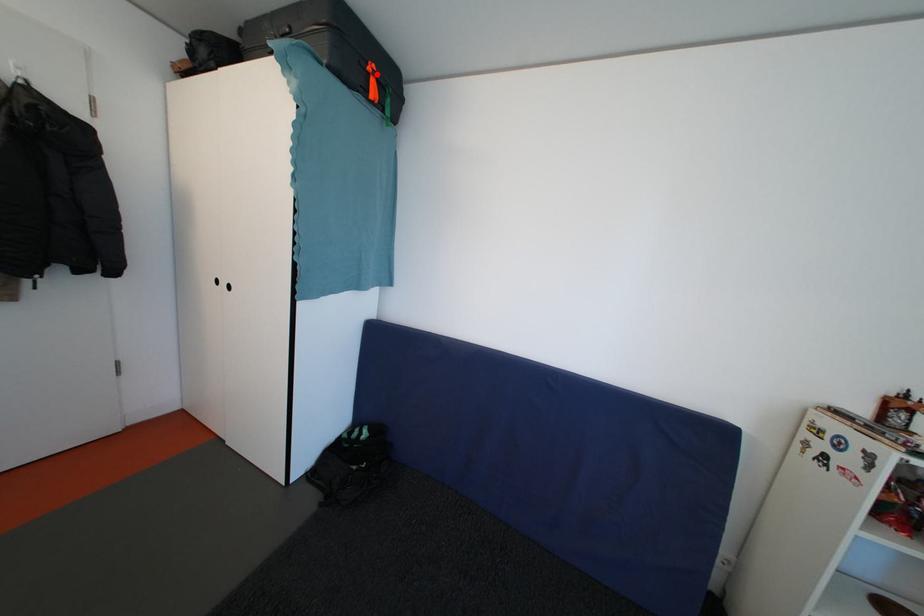
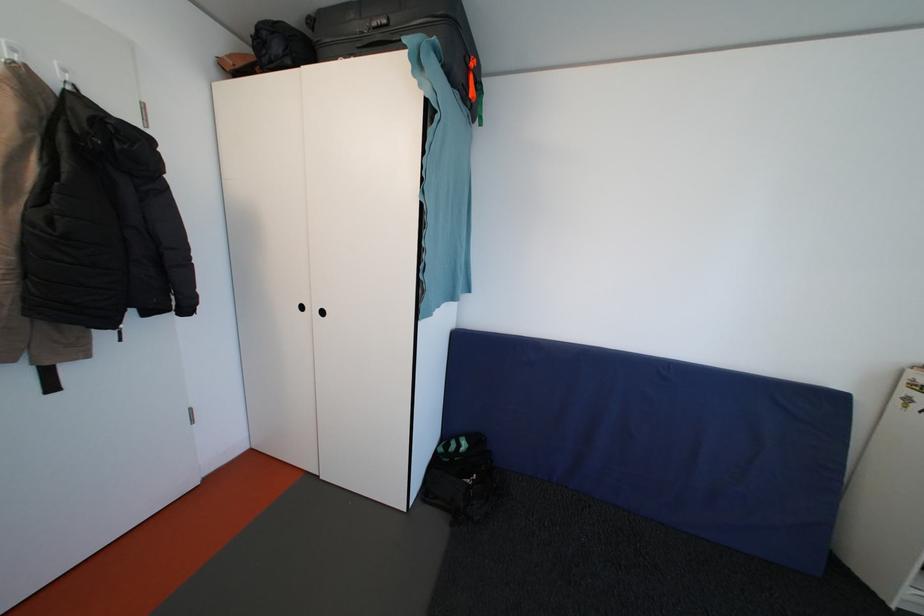
The point at the highlighted location is marked in the first image. Where is the corresponding point in the second image?

(479, 70)